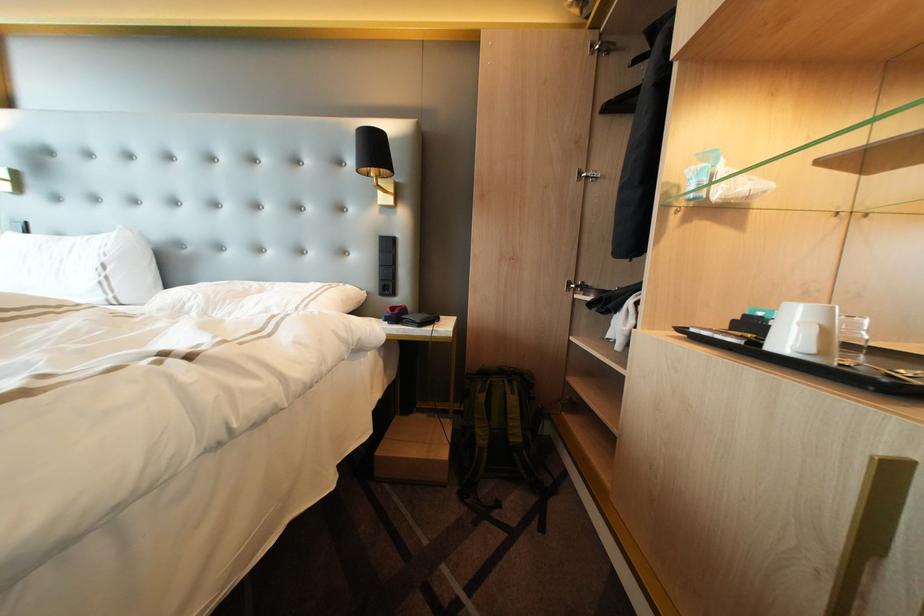
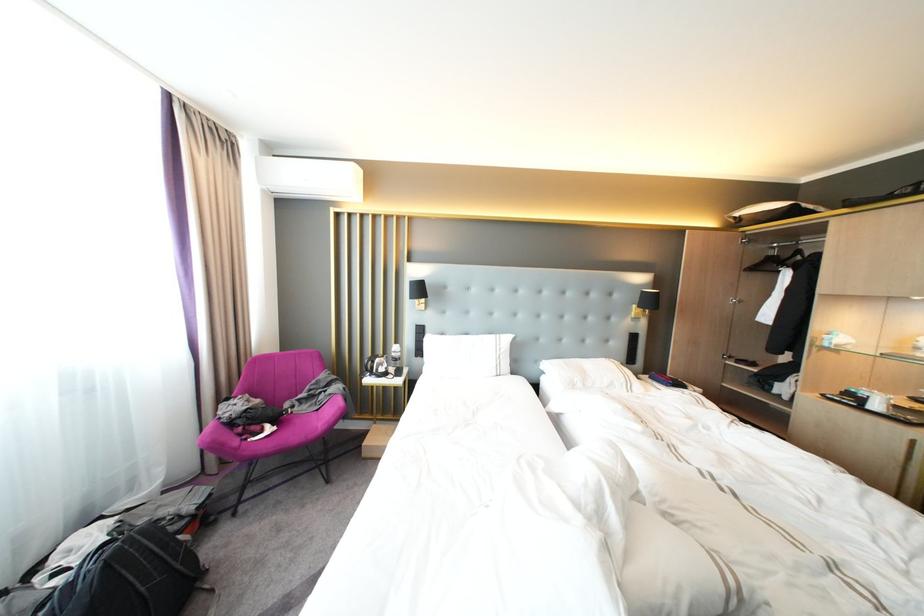
In the second image, find the point that corresponds to point 199,307 in the first image.

(586, 382)